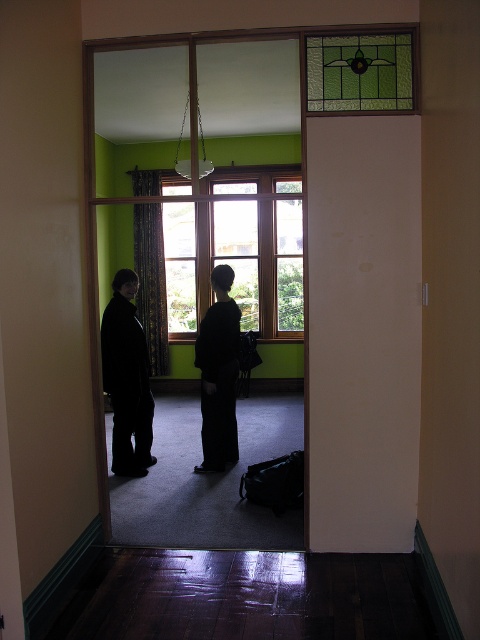
Question: Does wooden frame window at center have a greater width compared to black matte coat at center?

Choices:
 (A) no
 (B) yes

Answer: (B)

Question: Which point is closer to the camera taking this photo?

Choices:
 (A) (108, 365)
 (B) (247, 289)

Answer: (A)

Question: Can you confirm if wooden frame window at center is bigger than black fabric couple at center?

Choices:
 (A) yes
 (B) no

Answer: (A)

Question: Which point is closer to the camera?

Choices:
 (A) (116, 358)
 (B) (171, 305)

Answer: (A)

Question: Which point appears closest to the camera in this image?

Choices:
 (A) (278, 220)
 (B) (146, 392)
 (C) (103, 380)

Answer: (C)

Question: Can you confirm if wooden frame window at center is positioned to the right of black matte coat at center?

Choices:
 (A) no
 (B) yes

Answer: (B)